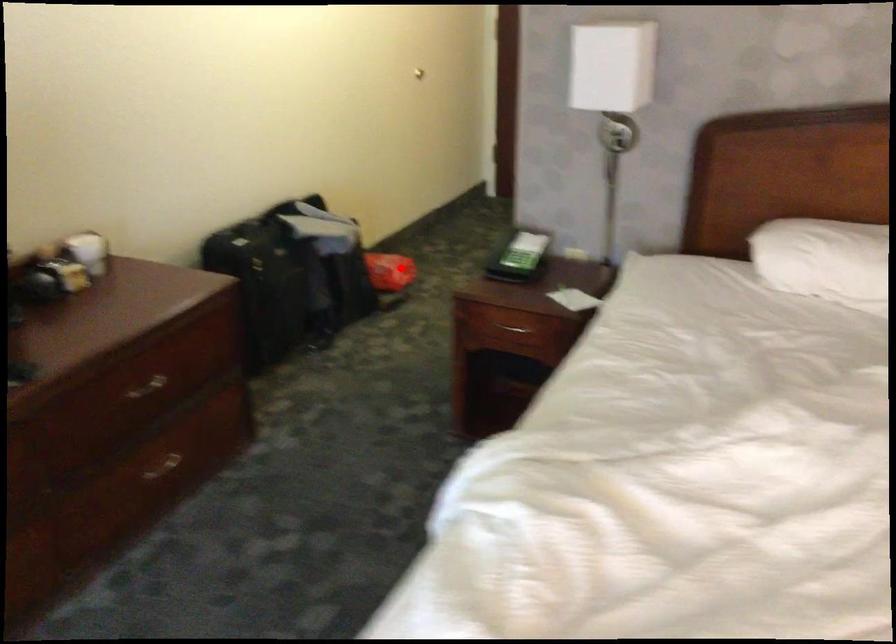
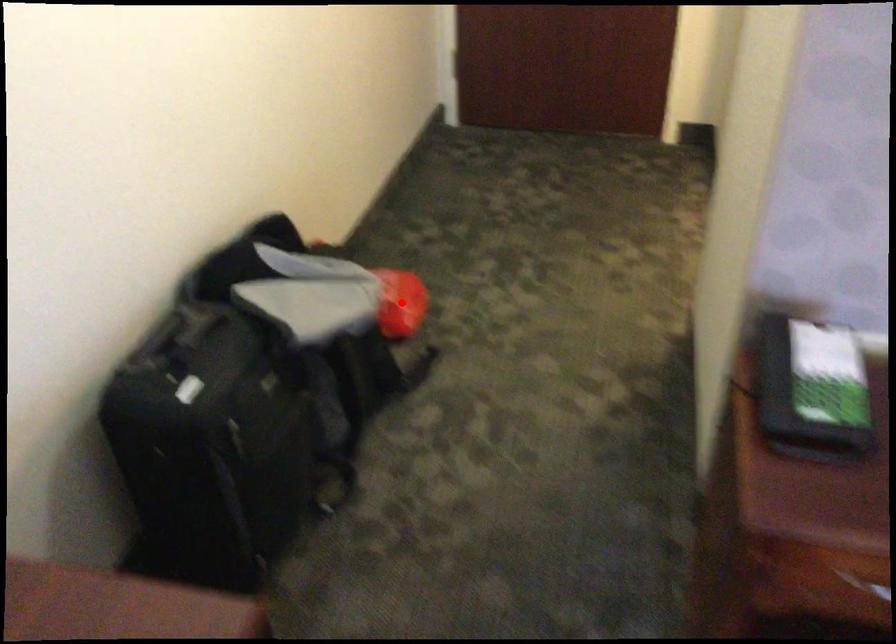
I am providing you with two images of the same scene from different viewpoints. A red point is marked on the first image and another point is marked on the second image. Is the marked point in image1 the same physical position as the marked point in image2?

Yes